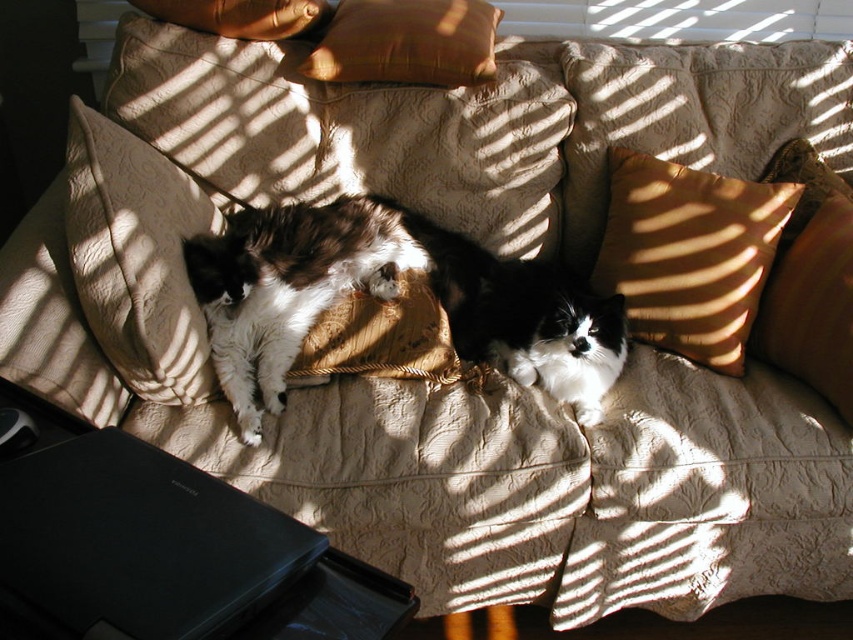
Question: Can you confirm if black plastic laptop at lower left is positioned to the right of white fluffy cat at center?

Choices:
 (A) no
 (B) yes

Answer: (A)

Question: Does suede-like tan pillow at right lie behind matte orange pillow at right?

Choices:
 (A) no
 (B) yes

Answer: (B)

Question: Estimate the real-world distances between objects in this image. Which object is closer to the suede-like tan pillow at right?

Choices:
 (A) velvet orange pillow at upper center
 (B) gold textured pillow at upper center
 (C) white fluffy cat at center

Answer: (C)

Question: Observing the image, what is the correct spatial positioning of beige quilted pillow at upper left in reference to white and brown fur cat at center?

Choices:
 (A) left
 (B) right

Answer: (A)

Question: Which object appears farthest from the camera in this image?

Choices:
 (A) beige quilted pillow at upper left
 (B) velvet orange pillow at upper center
 (C) white and brown fur cat at center

Answer: (B)

Question: Which point is closer to the camera?

Choices:
 (A) white and brown fur cat at center
 (B) black plastic laptop at lower left
 (C) velvet orange pillow at upper center

Answer: (B)